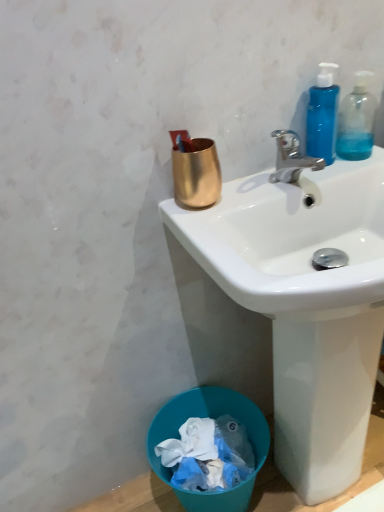
Image resolution: width=384 pixels, height=512 pixels. I want to click on blue plastic trash bin at lower left, so click(x=206, y=416).

Describe the element at coordinates (206, 416) in the screenshot. Image resolution: width=384 pixels, height=512 pixels. I see `blue plastic trash bin at lower left` at that location.

What are the coordinates of `blue translucent bottle at upper right, the 2th bottle viewed from the right` in the screenshot? It's located at (323, 115).

Describe the element at coordinates (323, 115) in the screenshot. I see `blue translucent bottle at upper right, the 2th bottle viewed from the right` at that location.

Image resolution: width=384 pixels, height=512 pixels. Identify the location of white glossy sink at upper center. (291, 308).

You are a GUI agent. You are given a task and a screenshot of the screen. Output one action in this format:
    pyautogui.click(x=<x>, y=<y>)
    Task: Click on the gold metallic cup at upper center
    The image size is (384, 512).
    Given the screenshot: What is the action you would take?
    pyautogui.click(x=197, y=175)

Considering the sizes of objects blue plastic trash bin at lower left and gold metallic cup at upper center in the image provided, who is wider, blue plastic trash bin at lower left or gold metallic cup at upper center?

Wider between the two is blue plastic trash bin at lower left.

Is blue plastic trash bin at lower left outside of gold metallic cup at upper center?

Yes, blue plastic trash bin at lower left is outside of gold metallic cup at upper center.

In terms of size, does blue plastic trash bin at lower left appear bigger or smaller than gold metallic cup at upper center?

Considering their sizes, blue plastic trash bin at lower left takes up more space than gold metallic cup at upper center.

From a real-world perspective, between blue plastic trash bin at lower left and gold metallic cup at upper center, who is vertically lower?

In real-world perspective, blue plastic trash bin at lower left is lower.

Considering the points (320, 117) and (154, 426), which point is in front, point (320, 117) or point (154, 426)?

The point (320, 117) is more forward.

Is blue translucent bottle at upper right, the 2th bottle viewed from the right, not inside blue plastic trash bin at lower left?

Yes, blue translucent bottle at upper right, the 2th bottle viewed from the right, is outside of blue plastic trash bin at lower left.

Is blue translucent bottle at upper right, which is the first bottle in left-to-right order, touching blue plastic trash bin at lower left?

blue translucent bottle at upper right, which is the first bottle in left-to-right order, and blue plastic trash bin at lower left are not in contact.

From the image's perspective, which is below, blue translucent bottle at upper right, the 2th bottle viewed from the right, or blue plastic trash bin at lower left?

blue plastic trash bin at lower left, from the image's perspective.

Would you say blue translucent bottle at upper right, the 2th bottle viewed from the right, is inside or outside polished chrome faucet at upper right?

blue translucent bottle at upper right, the 2th bottle viewed from the right, exists outside the volume of polished chrome faucet at upper right.

Image resolution: width=384 pixels, height=512 pixels. I want to click on faucet below the blue translucent bottle at upper right, which is the first bottle in left-to-right order (from the image's perspective), so (x=291, y=158).

Considering the sizes of blue translucent bottle at upper right, which is the first bottle in left-to-right order, and polished chrome faucet at upper right in the image, is blue translucent bottle at upper right, which is the first bottle in left-to-right order, bigger or smaller than polished chrome faucet at upper right?

Considering their sizes, blue translucent bottle at upper right, which is the first bottle in left-to-right order, takes up less space than polished chrome faucet at upper right.

Is the position of polished chrome faucet at upper right less distant than that of white glossy sink at upper center?

That is False.

From a real-world perspective, is polished chrome faucet at upper right above or below white glossy sink at upper center?

polished chrome faucet at upper right is above white glossy sink at upper center.

Is polished chrome faucet at upper right facing away from white glossy sink at upper center?

No, polished chrome faucet at upper right is not facing away from white glossy sink at upper center.

The height and width of the screenshot is (512, 384). In order to click on sink that is under the polished chrome faucet at upper right (from a real-world perspective) in this screenshot , I will do `click(291, 308)`.

From the blue plastic trash bin at lower left, count 1st bottles forward and point to it. Please provide its 2D coordinates.

[(356, 121)]

Is blue plastic trash bin at lower left completely or partially outside of transparent plastic bottle at upper right, placed as the 1th bottle when sorted from right to left?

blue plastic trash bin at lower left is positioned outside transparent plastic bottle at upper right, placed as the 1th bottle when sorted from right to left.

Based on their sizes in the image, would you say blue plastic trash bin at lower left is bigger or smaller than transparent plastic bottle at upper right, the 2th bottle viewed from the left?

Considering their sizes, blue plastic trash bin at lower left takes up more space than transparent plastic bottle at upper right, the 2th bottle viewed from the left.

Is blue plastic trash bin at lower left positioned with its back to transparent plastic bottle at upper right, the 2th bottle viewed from the left?

No.

From a real-world perspective, who is located higher, gold metallic cup at upper center or polished chrome faucet at upper right?

gold metallic cup at upper center, from a real-world perspective.

Are gold metallic cup at upper center and polished chrome faucet at upper right far apart?

They are positioned close to each other.

Is gold metallic cup at upper center wider than polished chrome faucet at upper right?

In fact, gold metallic cup at upper center might be narrower than polished chrome faucet at upper right.

From the image's perspective, is gold metallic cup at upper center located beneath polished chrome faucet at upper right?

Correct, gold metallic cup at upper center appears lower than polished chrome faucet at upper right in the image.

Does white glossy sink at upper center have a larger size compared to transparent plastic bottle at upper right, the 2th bottle viewed from the left?

Correct, white glossy sink at upper center is larger in size than transparent plastic bottle at upper right, the 2th bottle viewed from the left.

The height and width of the screenshot is (512, 384). Find the location of `sink that appears in front of the transparent plastic bottle at upper right, the 2th bottle viewed from the left`. sink that appears in front of the transparent plastic bottle at upper right, the 2th bottle viewed from the left is located at coordinates (291, 308).

From the image's perspective, is white glossy sink at upper center beneath transparent plastic bottle at upper right, placed as the 1th bottle when sorted from right to left?

Yes.

How many degrees apart are the facing directions of white glossy sink at upper center and transparent plastic bottle at upper right, the 2th bottle viewed from the left?

4.42 degrees.

At what (x,y) coordinates should I click in order to perform the action: click on trash bin/can beneath the gold metallic cup at upper center (from a real-world perspective). Please return your answer as a coordinate pair (x, y). Image resolution: width=384 pixels, height=512 pixels. Looking at the image, I should click on (206, 416).

Image resolution: width=384 pixels, height=512 pixels. In order to click on trash bin/can below the blue translucent bottle at upper right, the 2th bottle viewed from the right (from the image's perspective) in this screenshot , I will do `click(206, 416)`.

From the image, which object appears to be farther from white glossy sink at upper center, gold metallic cup at upper center or blue translucent bottle at upper right, the 2th bottle viewed from the right?

The object further to white glossy sink at upper center is blue translucent bottle at upper right, the 2th bottle viewed from the right.

In the scene shown: Which object lies nearer to the anchor point blue plastic trash bin at lower left, polished chrome faucet at upper right or transparent plastic bottle at upper right, the 2th bottle viewed from the left?

polished chrome faucet at upper right is positioned closer to the anchor blue plastic trash bin at lower left.

Based on their spatial positions, is polished chrome faucet at upper right or transparent plastic bottle at upper right, placed as the 1th bottle when sorted from right to left, further from white glossy sink at upper center?

transparent plastic bottle at upper right, placed as the 1th bottle when sorted from right to left.

Looking at the image, which one is located closer to transparent plastic bottle at upper right, the 2th bottle viewed from the left, gold metallic cup at upper center or blue translucent bottle at upper right, which is the first bottle in left-to-right order?

blue translucent bottle at upper right, which is the first bottle in left-to-right order, is positioned closer to the anchor transparent plastic bottle at upper right, the 2th bottle viewed from the left.

Based on their spatial positions, is blue translucent bottle at upper right, which is the first bottle in left-to-right order, or polished chrome faucet at upper right further from gold metallic cup at upper center?

blue translucent bottle at upper right, which is the first bottle in left-to-right order, lies further to gold metallic cup at upper center than the other object.

Considering their positions, is polished chrome faucet at upper right positioned further to blue plastic trash bin at lower left than white glossy sink at upper center?

Among the two, polished chrome faucet at upper right is located further to blue plastic trash bin at lower left.

Which object lies further to the anchor point white glossy sink at upper center, blue plastic trash bin at lower left or transparent plastic bottle at upper right, placed as the 1th bottle when sorted from right to left?

transparent plastic bottle at upper right, placed as the 1th bottle when sorted from right to left, is positioned further to the anchor white glossy sink at upper center.

Considering their positions, is transparent plastic bottle at upper right, the 2th bottle viewed from the left, positioned further to blue translucent bottle at upper right, which is the first bottle in left-to-right order, than polished chrome faucet at upper right?

transparent plastic bottle at upper right, the 2th bottle viewed from the left, is positioned further to the anchor blue translucent bottle at upper right, which is the first bottle in left-to-right order.

This screenshot has width=384, height=512. What are the coordinates of `coffee cup between blue translucent bottle at upper right, which is the first bottle in left-to-right order, and white glossy sink at upper center, in the vertical direction` in the screenshot? It's located at (197, 175).

Find the location of a particular element. This screenshot has height=512, width=384. faucet between gold metallic cup at upper center and blue translucent bottle at upper right, the 2th bottle viewed from the right is located at coordinates (291, 158).

Image resolution: width=384 pixels, height=512 pixels. I want to click on bottle between polished chrome faucet at upper right and transparent plastic bottle at upper right, the 2th bottle viewed from the left, in the horizontal direction, so click(323, 115).

Where is `faucet between blue translucent bottle at upper right, the 2th bottle viewed from the right, and white glossy sink at upper center, in the vertical direction`? faucet between blue translucent bottle at upper right, the 2th bottle viewed from the right, and white glossy sink at upper center, in the vertical direction is located at coordinates (291, 158).